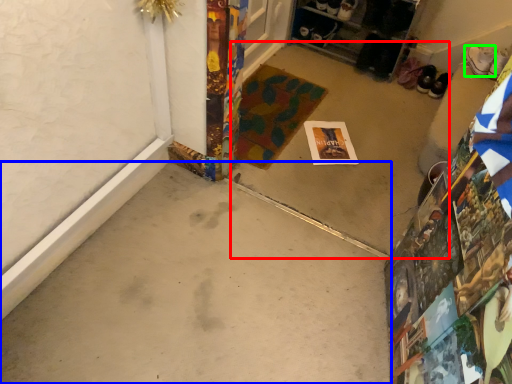
Question: Which is nearer to the concrete (highlighted by a red box)? concrete (highlighted by a blue box) or footwear (highlighted by a green box).

Choices:
 (A) concrete
 (B) footwear

Answer: (A)